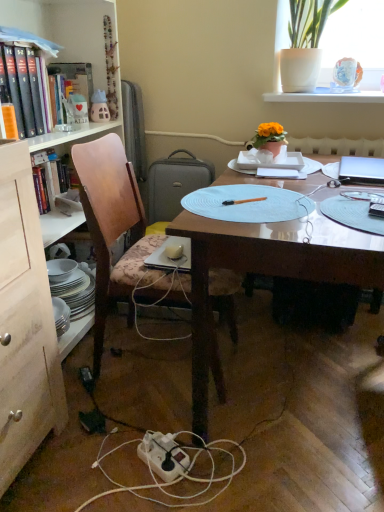
Question: Does light blue paper plate at center appear on the right side of silver metallic laptop at upper right?

Choices:
 (A) no
 (B) yes

Answer: (A)

Question: From the image's perspective, would you say light blue paper plate at center is shown under silver metallic laptop at upper right?

Choices:
 (A) no
 (B) yes

Answer: (B)

Question: Is light blue paper plate at center not near silver metallic laptop at upper right?

Choices:
 (A) no
 (B) yes

Answer: (A)

Question: Could you tell me if light blue paper plate at center is facing silver metallic laptop at upper right?

Choices:
 (A) no
 (B) yes

Answer: (A)

Question: From the image's perspective, would you say light blue paper plate at center is positioned over silver metallic laptop at upper right?

Choices:
 (A) yes
 (B) no

Answer: (B)

Question: Considering the positions of point coord(97,93) and point coord(296,197), is point coord(97,93) closer or farther from the camera than point coord(296,197)?

Choices:
 (A) farther
 (B) closer

Answer: (A)

Question: From a real-world perspective, is matte plastic toy house at upper left positioned above or below light blue paper plate at center?

Choices:
 (A) below
 (B) above

Answer: (B)

Question: Visually, is matte plastic toy house at upper left positioned to the left or to the right of light blue paper plate at center?

Choices:
 (A) left
 (B) right

Answer: (A)

Question: Is matte plastic toy house at upper left inside or outside of light blue paper plate at center?

Choices:
 (A) inside
 (B) outside

Answer: (B)

Question: Considering the positions of point (357, 172) and point (263, 248), is point (357, 172) closer or farther from the camera than point (263, 248)?

Choices:
 (A) farther
 (B) closer

Answer: (A)

Question: Relative to wooden desk at center, is silver metallic laptop at upper right in front or behind?

Choices:
 (A) front
 (B) behind

Answer: (B)

Question: From the image's perspective, is silver metallic laptop at upper right positioned above or below wooden desk at center?

Choices:
 (A) below
 (B) above

Answer: (B)

Question: Would you say silver metallic laptop at upper right is to the left or to the right of wooden desk at center in the picture?

Choices:
 (A) left
 (B) right

Answer: (B)

Question: Is orange matte book at left, marked as the second book in a back-to-front arrangement, taller or shorter than white plastic power outlet at lower center?

Choices:
 (A) short
 (B) tall

Answer: (B)

Question: In the image, is orange matte book at left, marked as the second book in a back-to-front arrangement, positioned in front of or behind white plastic power outlet at lower center?

Choices:
 (A) behind
 (B) front

Answer: (A)